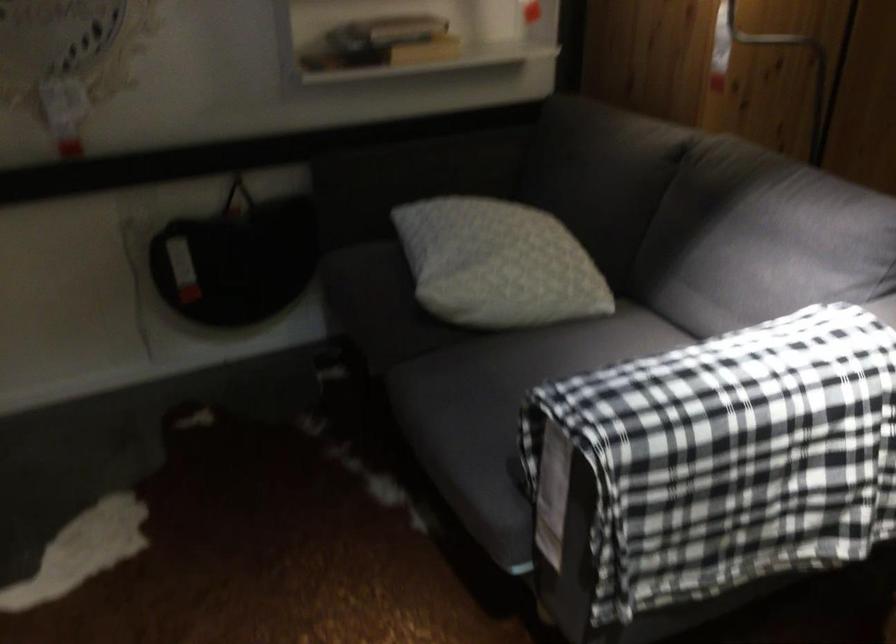
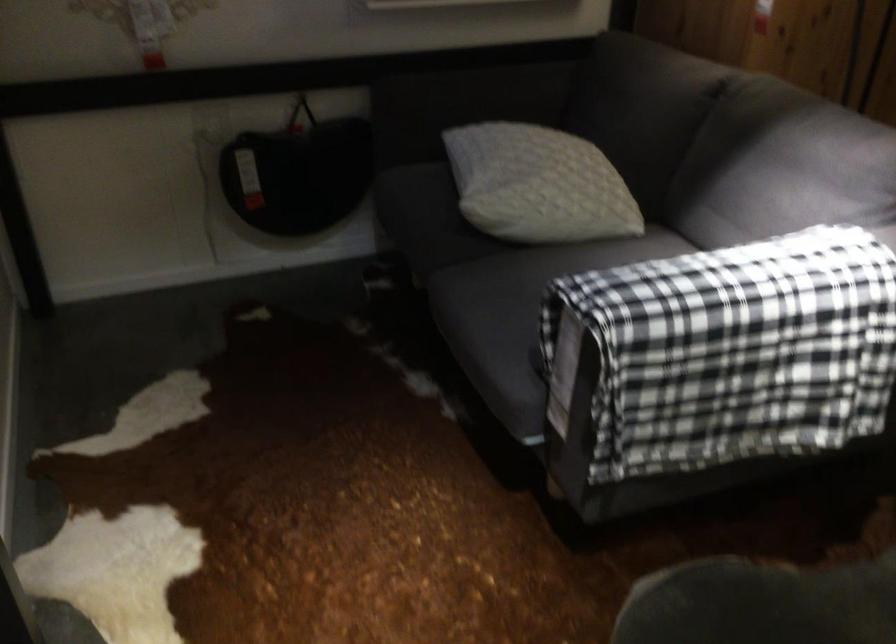
Question: Which direction would the cameraman need to move to produce the second image? Reply with the corresponding letter.

Choices:
 (A) Left
 (B) Right
 (C) Forward
 (D) Backward

Answer: (D)